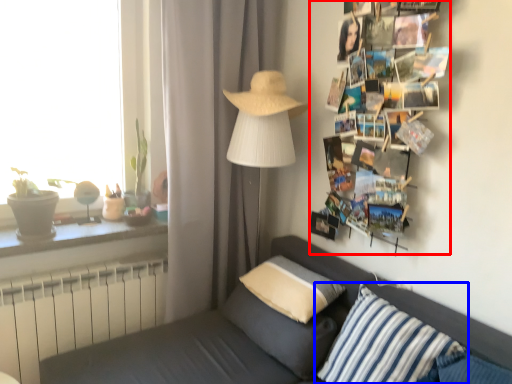
Question: Which object appears closest to the camera in this image, magazine (highlighted by a red box) or pillow (highlighted by a blue box)?

Choices:
 (A) magazine
 (B) pillow

Answer: (B)